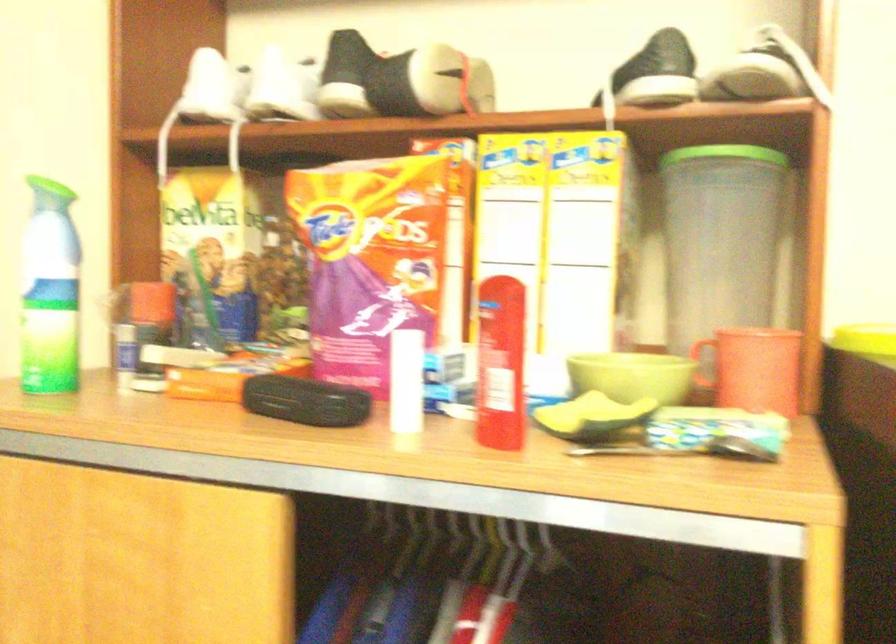
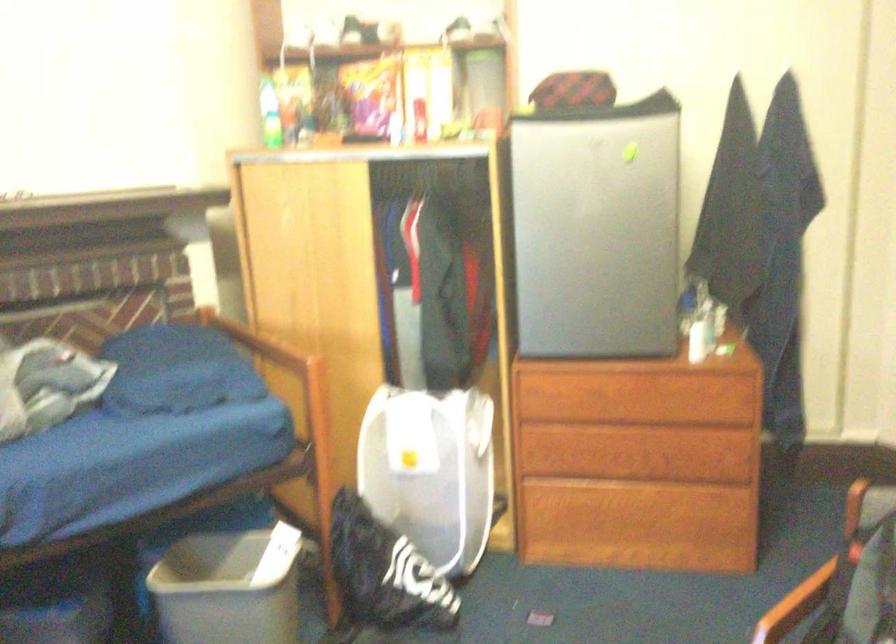
Question: The images are taken continuously from a first-person perspective. In which direction are you moving?

Choices:
 (A) Left
 (B) Right
 (C) Forward
 (D) Backward

Answer: (D)